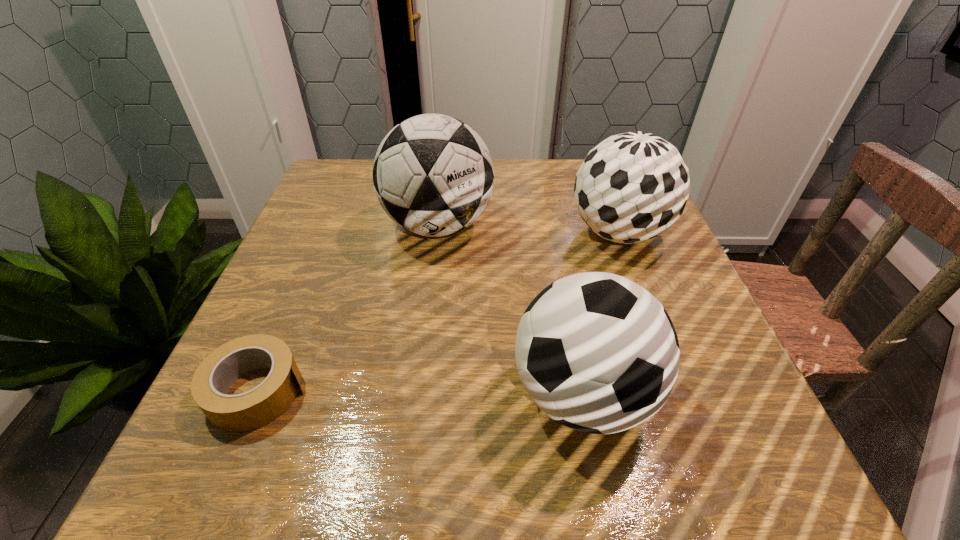
Identify which soccer ball is the second nearest to the leftmost soccer ball. Please provide its 2D coordinates. Your answer should be formatted as a tuple, i.e. [(x, y)], where the tuple contains the x and y coordinates of a point satisfying the conditions above.

[(596, 352)]

Image resolution: width=960 pixels, height=540 pixels. Identify the location of vacant point that satisfies the following two spatial constraints: 1. on the surface of the third object from right to left where the brand logo is visible; 2. at the edge of the shortest object. (419, 390).

Identify the location of vacant space that satisfies the following two spatial constraints: 1. at the edge of the leftmost object; 2. on the right side of the nearest soccer ball. The height and width of the screenshot is (540, 960). (256, 394).

Image resolution: width=960 pixels, height=540 pixels. I want to click on vacant space that satisfies the following two spatial constraints: 1. on the back side of the nearest soccer ball; 2. at the edge of the duct tape, so click(582, 390).

The height and width of the screenshot is (540, 960). I want to click on free spot that satisfies the following two spatial constraints: 1. on the surface of the leftmost soccer ball where the brand logo is visible; 2. at the edge of the duct tape, so click(419, 390).

Find the location of `vacant space that satisfies the following two spatial constraints: 1. at the edge of the leftmost object; 2. on the back side of the nearest soccer ball`. vacant space that satisfies the following two spatial constraints: 1. at the edge of the leftmost object; 2. on the back side of the nearest soccer ball is located at coordinates (256, 394).

At what (x,y) coordinates should I click in order to perform the action: click on free space that satisfies the following two spatial constraints: 1. on the surface of the leftmost soccer ball where the brand logo is visible; 2. at the edge of the leftmost object. Please return your answer as a coordinate pair (x, y). The width and height of the screenshot is (960, 540). Looking at the image, I should click on (419, 390).